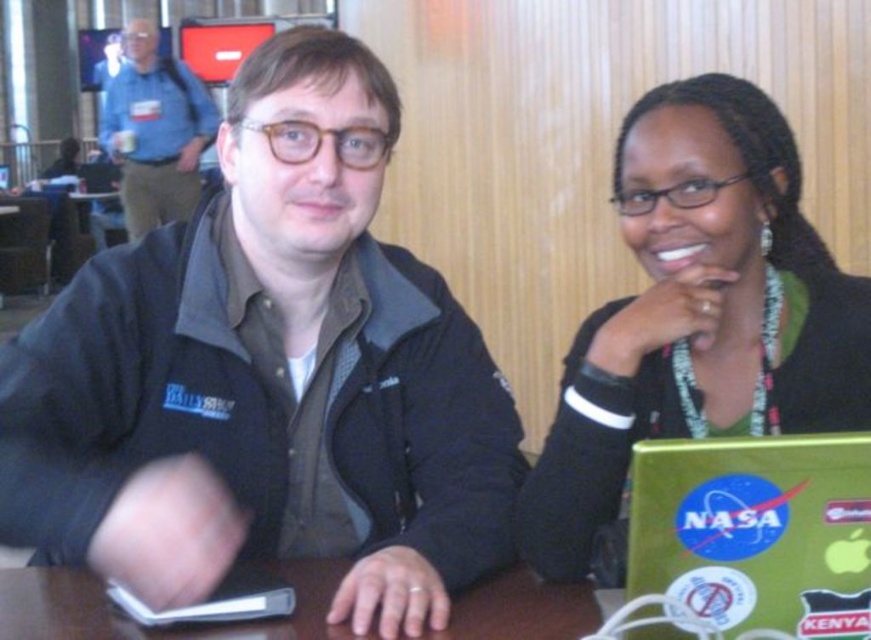
Question: Does black matte jacket at left lie behind green matte laptop at lower right?

Choices:
 (A) no
 (B) yes

Answer: (B)

Question: Which of the following is the farthest from the observer?

Choices:
 (A) blue fabric jacket at upper left
 (B) brown wooden table at center
 (C) green matte laptop at center
 (D) green matte laptop at lower right

Answer: (A)

Question: Which point appears closest to the camera in this image?

Choices:
 (A) (190, 76)
 (B) (576, 625)

Answer: (B)

Question: Which object appears closest to the camera in this image?

Choices:
 (A) green matte laptop at lower right
 (B) green matte laptop at center
 (C) black matte jacket at left

Answer: (A)

Question: Is green matte laptop at center thinner than brown wooden table at center?

Choices:
 (A) no
 (B) yes

Answer: (B)

Question: Is green matte laptop at center below blue fabric jacket at upper left?

Choices:
 (A) yes
 (B) no

Answer: (A)